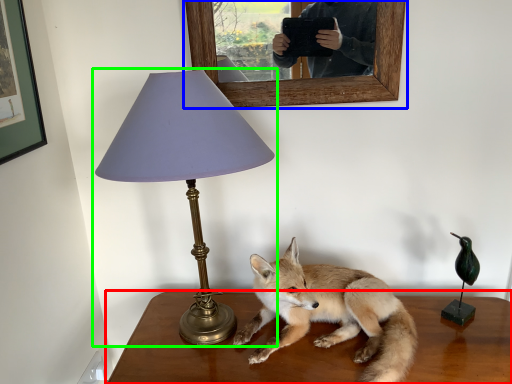
Question: Considering the real-world distances, which object is farthest from table (highlighted by a red box)? picture frame (highlighted by a blue box) or lamp (highlighted by a green box)?

Choices:
 (A) picture frame
 (B) lamp

Answer: (A)